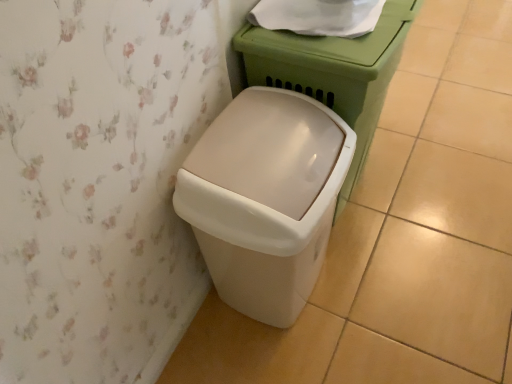
Question: Is beige plastic waste container at lower left shorter than white paper at upper center?

Choices:
 (A) no
 (B) yes

Answer: (A)

Question: Does beige plastic waste container at lower left have a greater height compared to white paper at upper center?

Choices:
 (A) yes
 (B) no

Answer: (A)

Question: Does beige plastic waste container at lower left turn towards white paper at upper center?

Choices:
 (A) no
 (B) yes

Answer: (A)

Question: Is beige plastic waste container at lower left in contact with white paper at upper center?

Choices:
 (A) no
 (B) yes

Answer: (A)

Question: Is beige plastic waste container at lower left oriented away from white paper at upper center?

Choices:
 (A) yes
 (B) no

Answer: (B)

Question: Based on their sizes in the image, would you say beige plastic waste container at lower left is bigger or smaller than white glossy porcelain at center?

Choices:
 (A) big
 (B) small

Answer: (B)

Question: From a real-world perspective, is beige plastic waste container at lower left above or below white glossy porcelain at center?

Choices:
 (A) below
 (B) above

Answer: (A)

Question: Do you think beige plastic waste container at lower left is within white glossy porcelain at center, or outside of it?

Choices:
 (A) inside
 (B) outside

Answer: (B)

Question: In the image, is beige plastic waste container at lower left on the left side or the right side of white glossy porcelain at center?

Choices:
 (A) left
 (B) right

Answer: (A)

Question: Looking at the image, does white paper at upper center seem bigger or smaller compared to white glossy porcelain at center?

Choices:
 (A) big
 (B) small

Answer: (B)

Question: Is white paper at upper center taller or shorter than white glossy porcelain at center?

Choices:
 (A) short
 (B) tall

Answer: (A)

Question: Considering the positions of white paper at upper center and white glossy porcelain at center in the image, is white paper at upper center wider or thinner than white glossy porcelain at center?

Choices:
 (A) wide
 (B) thin

Answer: (B)

Question: Considering the relative positions of white paper at upper center and white glossy porcelain at center in the image provided, is white paper at upper center to the left or to the right of white glossy porcelain at center?

Choices:
 (A) right
 (B) left

Answer: (B)

Question: Is beige plastic waste container at lower left in front of or behind white paper at upper center in the image?

Choices:
 (A) behind
 (B) front

Answer: (B)

Question: Considering the positions of beige plastic waste container at lower left and white paper at upper center in the image, is beige plastic waste container at lower left wider or thinner than white paper at upper center?

Choices:
 (A) thin
 (B) wide

Answer: (B)